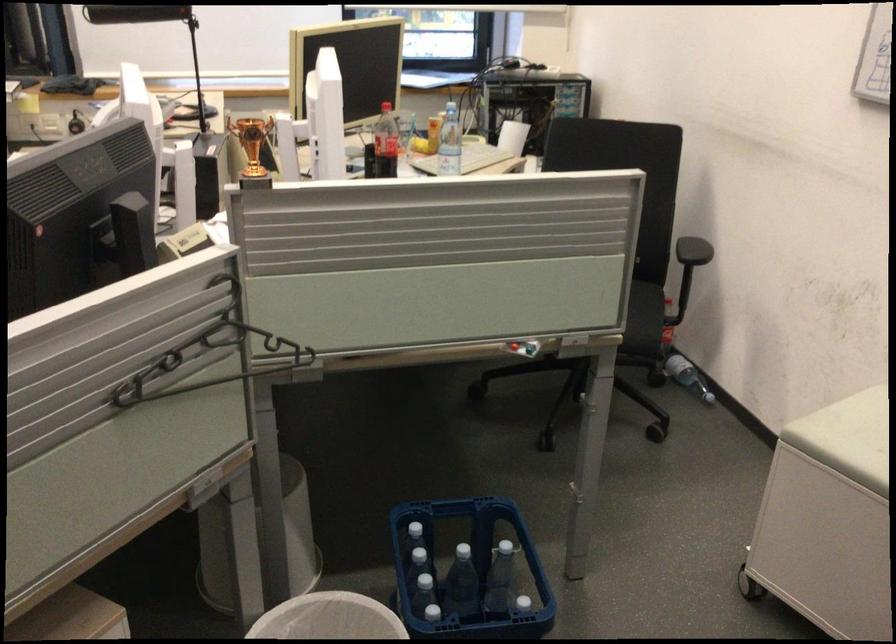
At what (x,y) coordinates should I click in order to perform the action: click on coca-cola bottle. Please return your answer as a coordinate pair (x, y). This screenshot has width=896, height=644. Looking at the image, I should click on (385, 143).